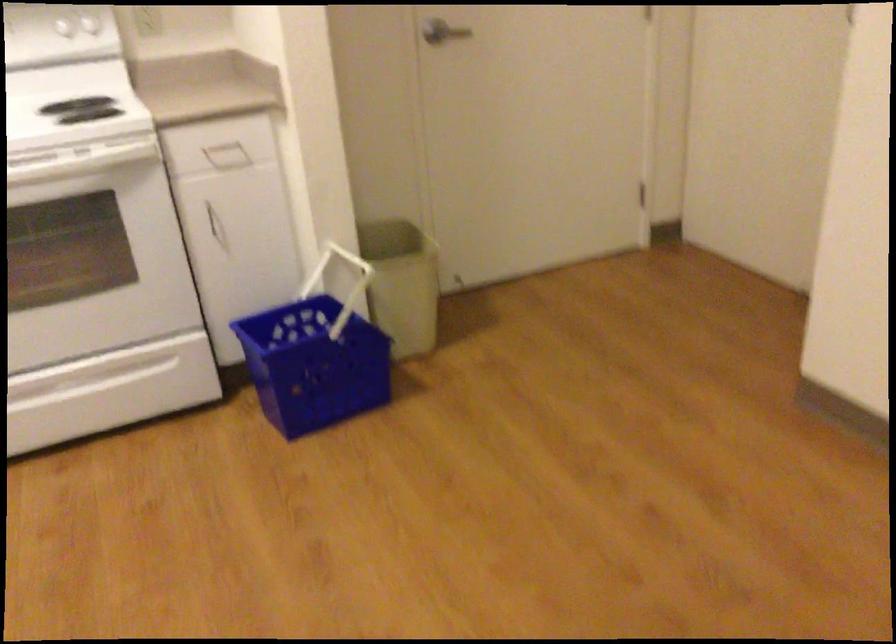
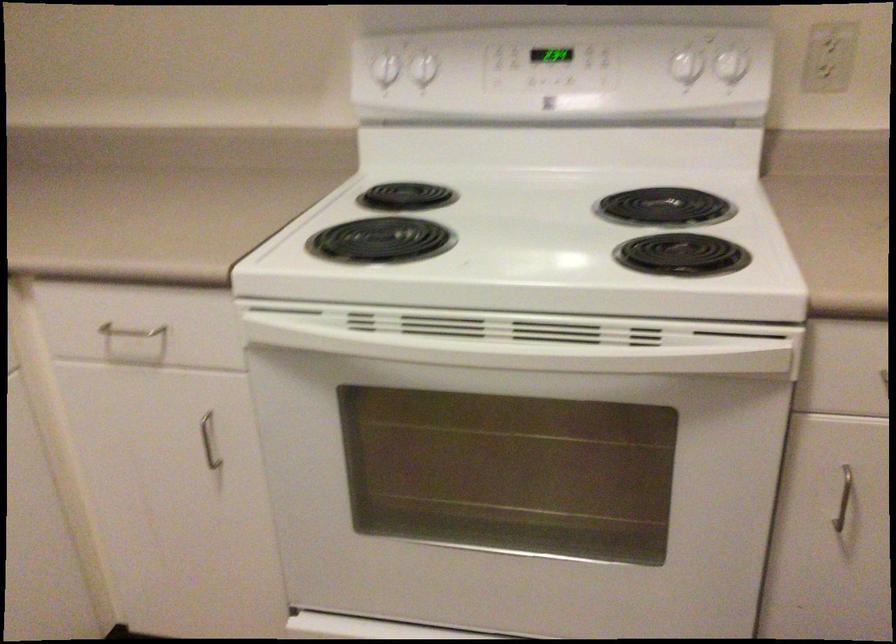
The point at (214, 219) is marked in the first image. Where is the corresponding point in the second image?

(842, 498)